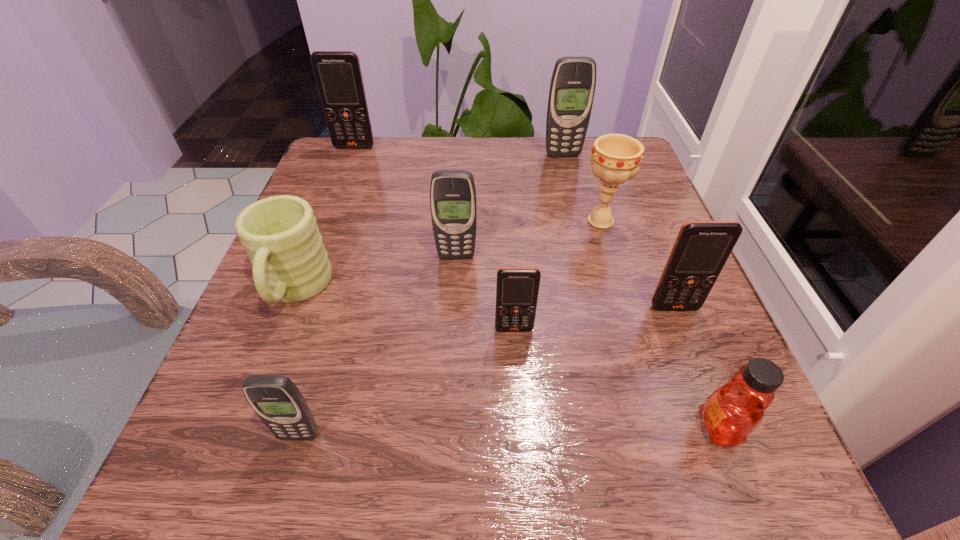
Where is `vacant area between the farthest orange cellular telephone and the farthest gray cellular telephone`? vacant area between the farthest orange cellular telephone and the farthest gray cellular telephone is located at coordinates (459, 151).

Locate an element on the screen. This screenshot has height=540, width=960. the second closest object to the honey is located at coordinates (517, 288).

I want to click on object that ranks as the seventh closest to the fifth nearest cellular telephone, so click(x=733, y=411).

Image resolution: width=960 pixels, height=540 pixels. I want to click on the fifth closest cellular telephone relative to the honey, so click(x=572, y=88).

I want to click on the fourth closest cellular telephone to the honey, so click(x=277, y=401).

Where is `orange cellular telephone that stands as the second closest to the farthest object`? orange cellular telephone that stands as the second closest to the farthest object is located at coordinates (701, 249).

The image size is (960, 540). What are the coordinates of `orange cellular telephone that is the third nearest to the green mug` in the screenshot? It's located at (701, 249).

Where is `gray cellular telephone that can be found as the second closest to the farthest orange cellular telephone`? The width and height of the screenshot is (960, 540). gray cellular telephone that can be found as the second closest to the farthest orange cellular telephone is located at coordinates (453, 205).

You are a GUI agent. You are given a task and a screenshot of the screen. Output one action in this format:
    pyautogui.click(x=<x>, y=<y>)
    Task: Click on the second closest gray cellular telephone relative to the second gray cellular telephone from left to right
    This screenshot has width=960, height=540.
    Given the screenshot: What is the action you would take?
    pyautogui.click(x=572, y=88)

Locate an element on the screen. free space in the image that satisfies the following two spatial constraints: 1. on the front label of the honey; 2. on the screen of the smallest gray cellular telephone is located at coordinates (722, 435).